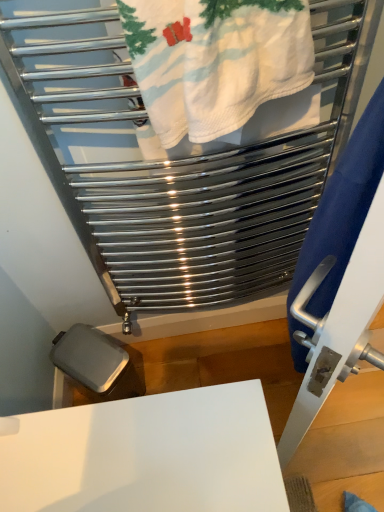
Locate an element on the screen. Image resolution: width=384 pixels, height=512 pixels. polished metal radiator at upper center is located at coordinates (175, 161).

This screenshot has width=384, height=512. What do you see at coordinates (175, 161) in the screenshot?
I see `polished metal radiator at upper center` at bounding box center [175, 161].

At what (x,y) coordinates should I click in order to perform the action: click on polished metal radiator at upper center. Please return your answer as a coordinate pair (x, y). The width and height of the screenshot is (384, 512). Looking at the image, I should click on (175, 161).